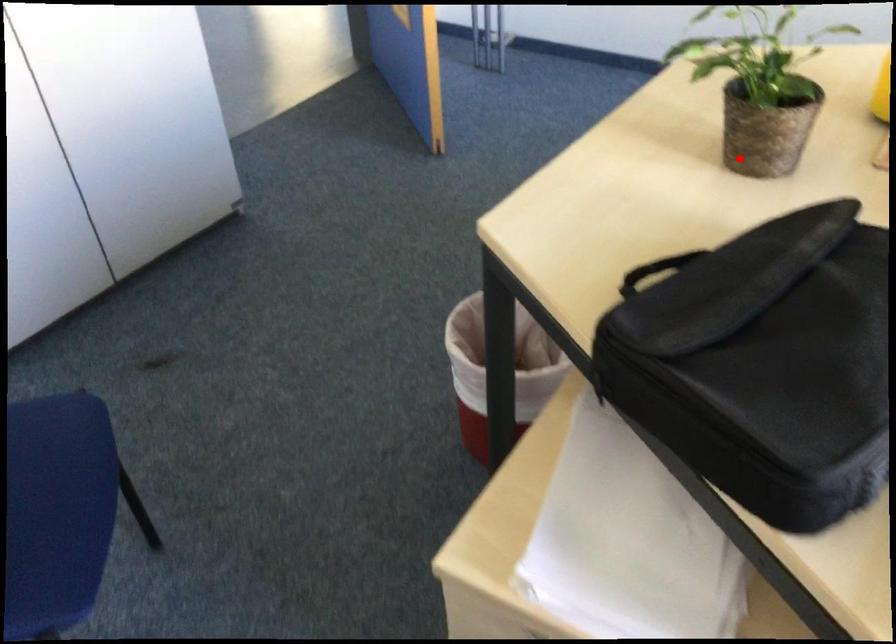
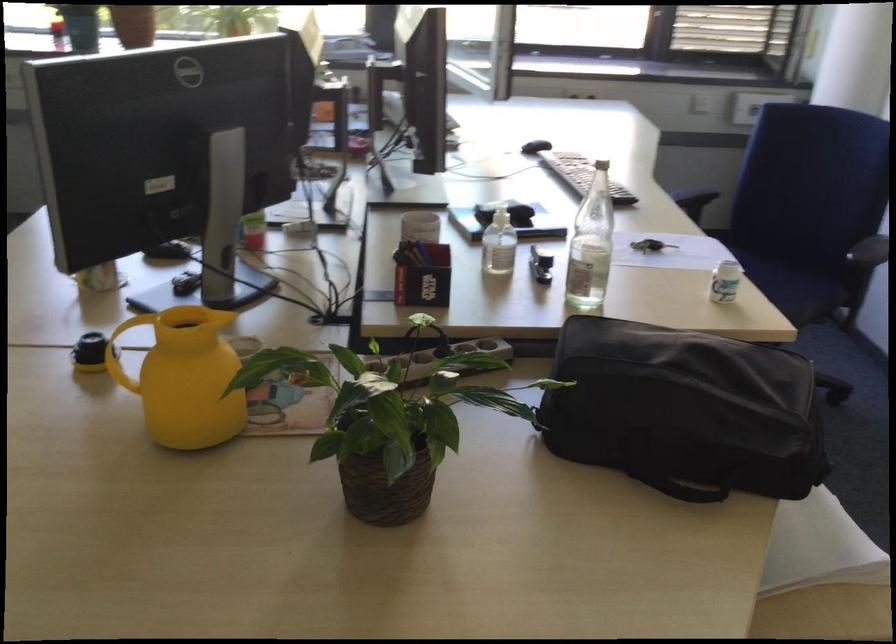
Question: I am providing you with two images of the same scene from different viewpoints. A red point is marked on the first image. Is the red point's position out of view in image 2?

Choices:
 (A) Yes
 (B) No

Answer: (B)